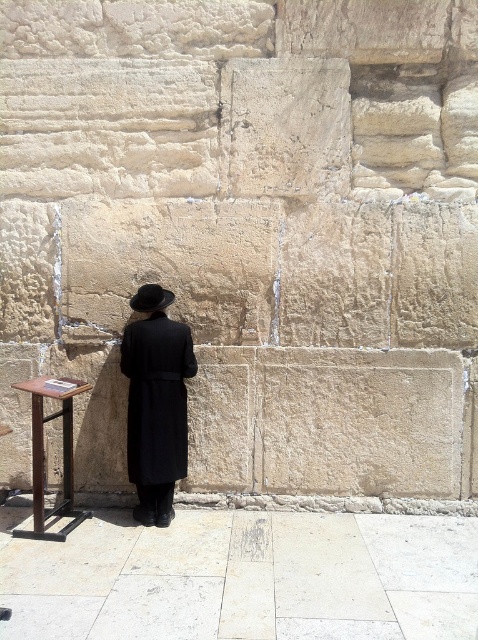
Question: Can you confirm if black matte coat at center is smaller than black felt fedora at center?

Choices:
 (A) no
 (B) yes

Answer: (A)

Question: Is black matte coat at center thinner than brown wooden stool at lower left?

Choices:
 (A) no
 (B) yes

Answer: (B)

Question: Which object is the closest to the brown wooden stool at lower left?

Choices:
 (A) black felt fedora at center
 (B) black matte coat at center

Answer: (B)

Question: Which of these objects is positioned closest to the black matte coat at center?

Choices:
 (A) brown wooden stool at lower left
 (B) black felt fedora at center

Answer: (B)

Question: Is brown wooden stool at lower left below black felt fedora at center?

Choices:
 (A) yes
 (B) no

Answer: (A)

Question: Which object is farther from the camera taking this photo?

Choices:
 (A) black matte coat at center
 (B) black felt fedora at center
 (C) brown wooden stool at lower left

Answer: (B)